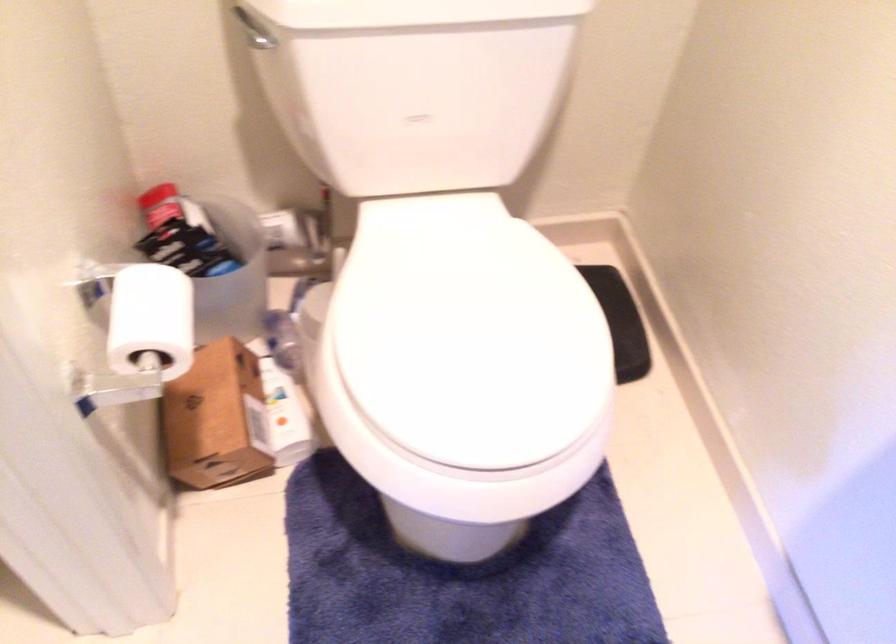
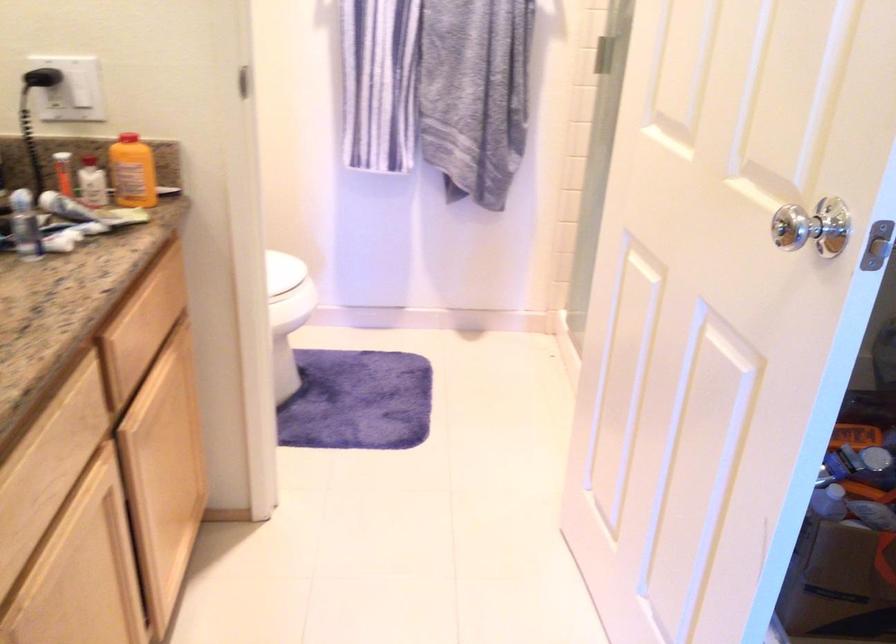
Question: I am providing you with two images of the same scene from different viewpoints. Please identify which objects are invisible in image2.

Choices:
 (A) white toilet lid
 (B) black electrical plug
 (C) small brown jar
 (D) white bottle

Answer: (A)